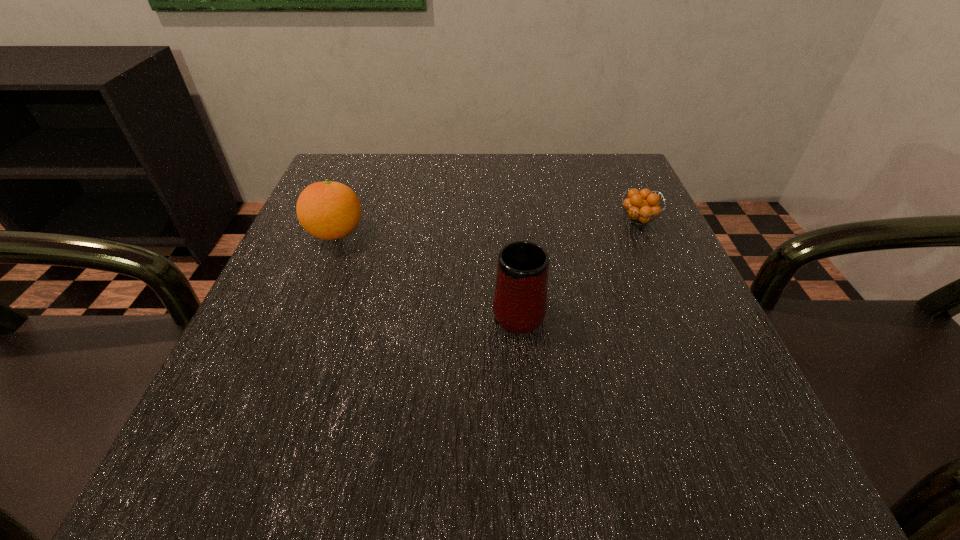
The image size is (960, 540). I want to click on the second object from right to left, so click(520, 297).

The height and width of the screenshot is (540, 960). I want to click on the nearest object, so click(520, 297).

Where is `the taller orange fruit`? the taller orange fruit is located at coordinates (328, 210).

Where is `the left orange fruit`? This screenshot has height=540, width=960. the left orange fruit is located at coordinates (328, 210).

In order to click on the rightmost object in this screenshot , I will do `click(642, 206)`.

Where is `the right orange fruit`? This screenshot has width=960, height=540. the right orange fruit is located at coordinates pyautogui.click(x=642, y=206).

At what (x,y) coordinates should I click in order to perform the action: click on free space located on the side of the nearest object with the handle. Please return your answer as a coordinate pair (x, y). Looking at the image, I should click on pos(511,217).

Identify the location of free region located on the side of the nearest object with the handle. The height and width of the screenshot is (540, 960). (511, 226).

Identify the location of vacant region located on the side of the nearest object with the handle. (510, 206).

Where is `vacant space situated on the front of the left orange fruit`? Image resolution: width=960 pixels, height=540 pixels. vacant space situated on the front of the left orange fruit is located at coordinates (319, 278).